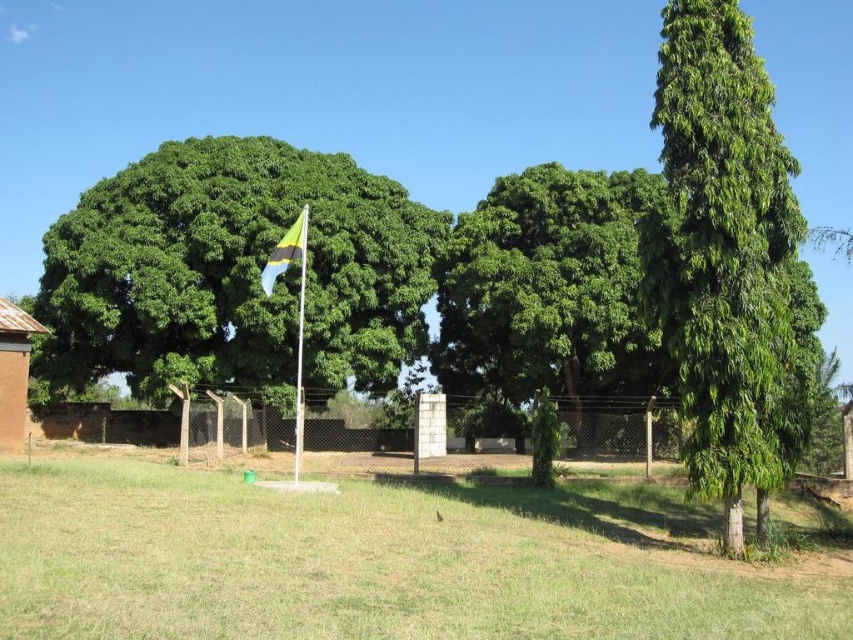
Question: Which object is positioned closest to the blue-green fabric flag at center-left?

Choices:
 (A) brown clay hut at lower left
 (B) white plastic flag pole at center

Answer: (B)

Question: Estimate the real-world distances between objects in this image. Which object is closer to the blue-green fabric flag at center-left?

Choices:
 (A) green grass at center
 (B) green leafy tree at left
 (C) white plastic flag pole at center
 (D) brown clay hut at lower left

Answer: (C)

Question: Estimate the real-world distances between objects in this image. Which object is closer to the green grass at center?

Choices:
 (A) green leafy tree at center
 (B) green leafy tree at left

Answer: (A)

Question: Can you confirm if green leafy tree at right is thinner than white plastic flag pole at center?

Choices:
 (A) yes
 (B) no

Answer: (B)

Question: Does white plastic flag pole at center appear under blue-green fabric flag at center-left?

Choices:
 (A) yes
 (B) no

Answer: (A)

Question: Is green leafy tree at right further to the viewer compared to blue-green fabric flag at center-left?

Choices:
 (A) no
 (B) yes

Answer: (A)